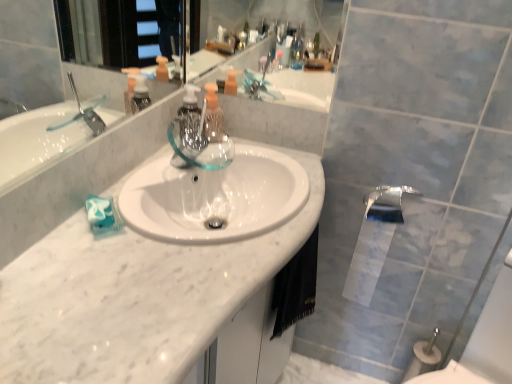
Question: In terms of width, does translucent plastic soap dispenser at center look wider or thinner when compared to black fabric hand towel at lower center?

Choices:
 (A) thin
 (B) wide

Answer: (A)

Question: Is translucent plastic soap dispenser at center bigger or smaller than black fabric hand towel at lower center?

Choices:
 (A) small
 (B) big

Answer: (A)

Question: Which is farther from the white glossy toilet paper at lower right?

Choices:
 (A) white marble counter top at center
 (B) black fabric hand towel at lower center
 (C) polished chrome tap at lower right
 (D) translucent plastic soap dispenser at center

Answer: (A)

Question: Which object is the farthest from the white marble counter top at center?

Choices:
 (A) translucent plastic soap dispenser at center
 (B) white glossy toilet paper at lower right
 (C) polished chrome tap at lower right
 (D) black fabric hand towel at lower center

Answer: (C)